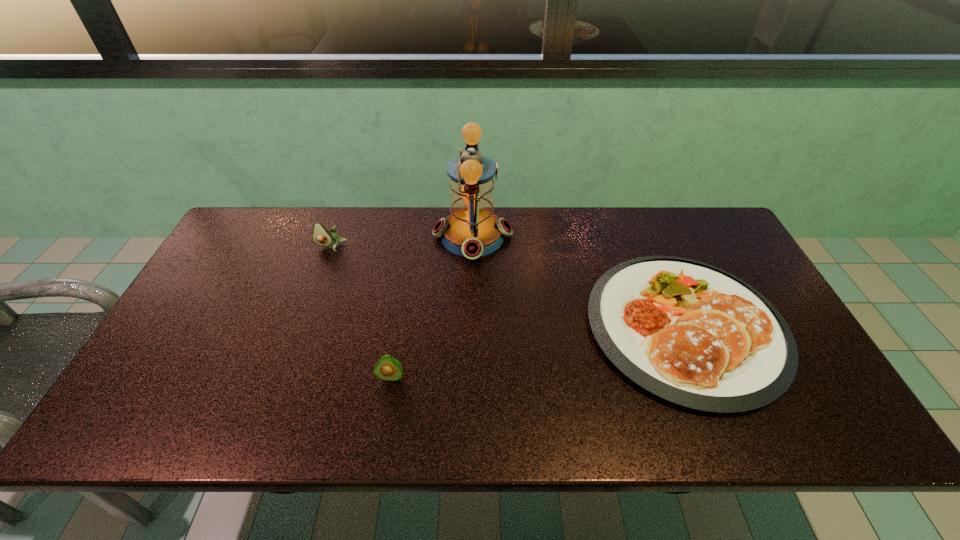
Identify the location of vacant space at the far left corner of the desktop. The height and width of the screenshot is (540, 960). (263, 224).

The height and width of the screenshot is (540, 960). In the image, there is a desktop. Find the location of `vacant space at the far right corner`. vacant space at the far right corner is located at coordinates (722, 222).

Image resolution: width=960 pixels, height=540 pixels. What are the coordinates of `unoccupied area between the dish and the lantern` in the screenshot? It's located at (579, 281).

This screenshot has height=540, width=960. What are the coordinates of `vacant space that is in between the lantern and the left avocado` in the screenshot? It's located at (402, 241).

The width and height of the screenshot is (960, 540). In order to click on unoccupied position between the nearer avocado and the tallest object in this screenshot , I will do `click(432, 306)`.

At what (x,y) coordinates should I click in order to perform the action: click on vacant point located between the leftmost object and the right avocado. Please return your answer as a coordinate pair (x, y). The width and height of the screenshot is (960, 540). Looking at the image, I should click on (361, 312).

Where is `free space that is in between the farther avocado and the right avocado`? free space that is in between the farther avocado and the right avocado is located at coordinates (361, 312).

What are the coordinates of `vacant area that lies between the right avocado and the dish` in the screenshot? It's located at (538, 352).

Where is `free space between the tallest object and the rightmost object`? free space between the tallest object and the rightmost object is located at coordinates (579, 281).

This screenshot has width=960, height=540. Find the location of `free point between the lantern and the left avocado`. free point between the lantern and the left avocado is located at coordinates (402, 241).